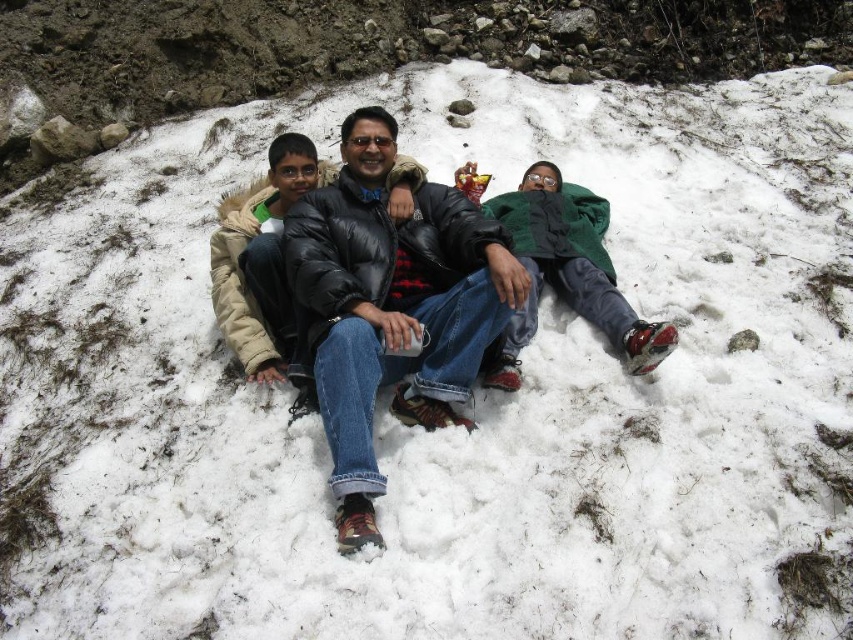
Question: Can you confirm if green matte jacket at center is positioned below black puffer jacket at center?

Choices:
 (A) no
 (B) yes

Answer: (B)

Question: Which object is the closest to the green matte jacket at center?

Choices:
 (A) green fleece blanket at center
 (B) black puffer jacket at center
 (C) matte black jacket at center

Answer: (A)

Question: Is matte black jacket at center to the right of green matte jacket at center from the viewer's perspective?

Choices:
 (A) yes
 (B) no

Answer: (B)

Question: Is green matte jacket at center positioned behind green fleece blanket at center?

Choices:
 (A) yes
 (B) no

Answer: (B)

Question: Considering the real-world distances, which object is closest to the green fleece blanket at center?

Choices:
 (A) matte black jacket at center
 (B) black puffer jacket at center

Answer: (A)

Question: Which of the following is the farthest from the observer?

Choices:
 (A) (614, 272)
 (B) (502, 326)

Answer: (A)